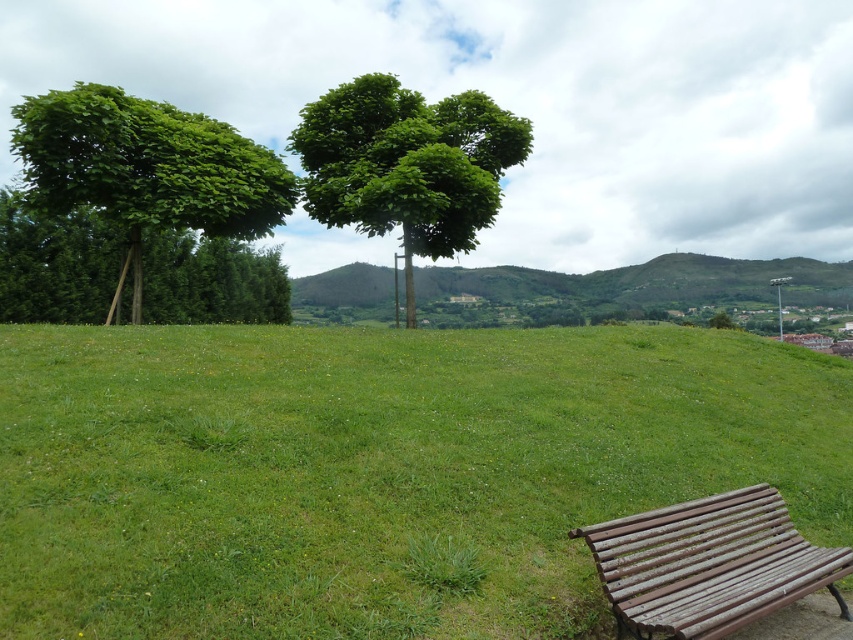
Question: Can you confirm if green leafy tree at center is smaller than rusty wood bench at lower right?

Choices:
 (A) no
 (B) yes

Answer: (A)

Question: In this image, where is green grassy hillside at center located relative to rusty wood bench at lower right?

Choices:
 (A) right
 (B) left

Answer: (A)

Question: Estimate the real-world distances between objects in this image. Which object is closer to the green leafy tree at center?

Choices:
 (A) green leafy tree at left
 (B) green grassy at lower right

Answer: (A)

Question: Which of the following is the farthest from the observer?

Choices:
 (A) green grassy hillside at center
 (B) green grassy at lower right
 (C) green leafy tree at left
 (D) green leafy tree at center

Answer: (A)

Question: Does green grassy hillside at center have a smaller size compared to rusty wood bench at lower right?

Choices:
 (A) no
 (B) yes

Answer: (A)

Question: Among these objects, which one is farthest from the camera?

Choices:
 (A) green leafy tree at left
 (B) rusty wood bench at lower right

Answer: (A)